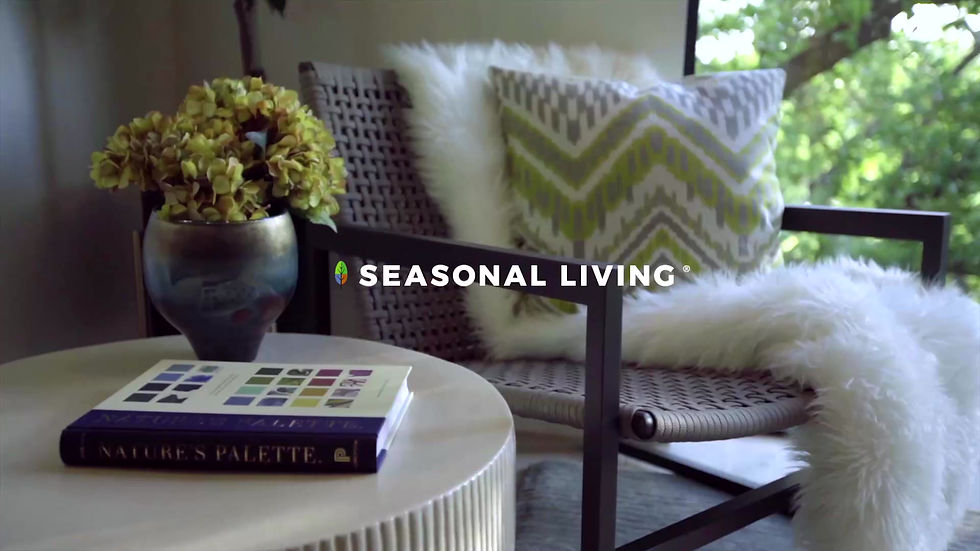
This screenshot has height=551, width=980. In order to click on arms on chair in this screenshot , I will do `click(492, 268)`, `click(847, 215)`.